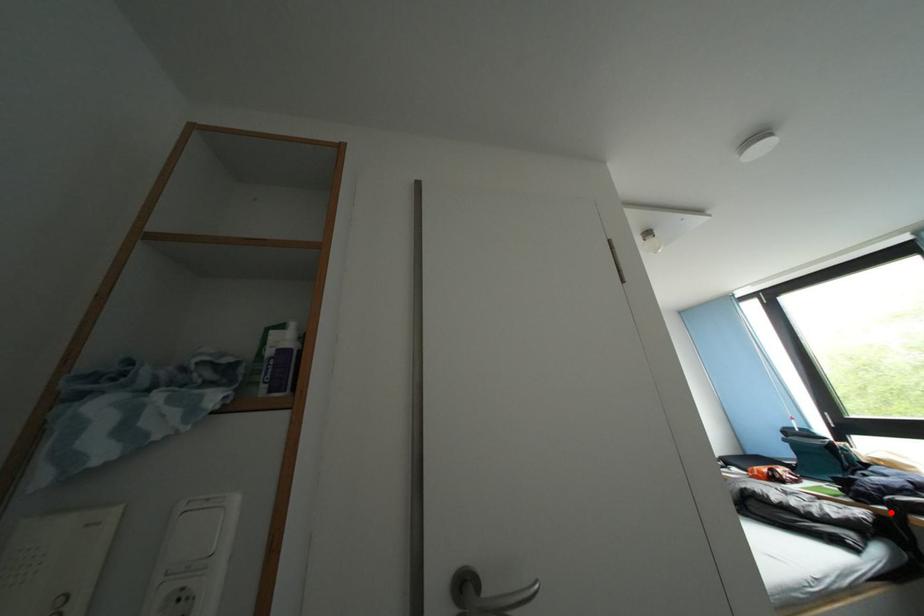
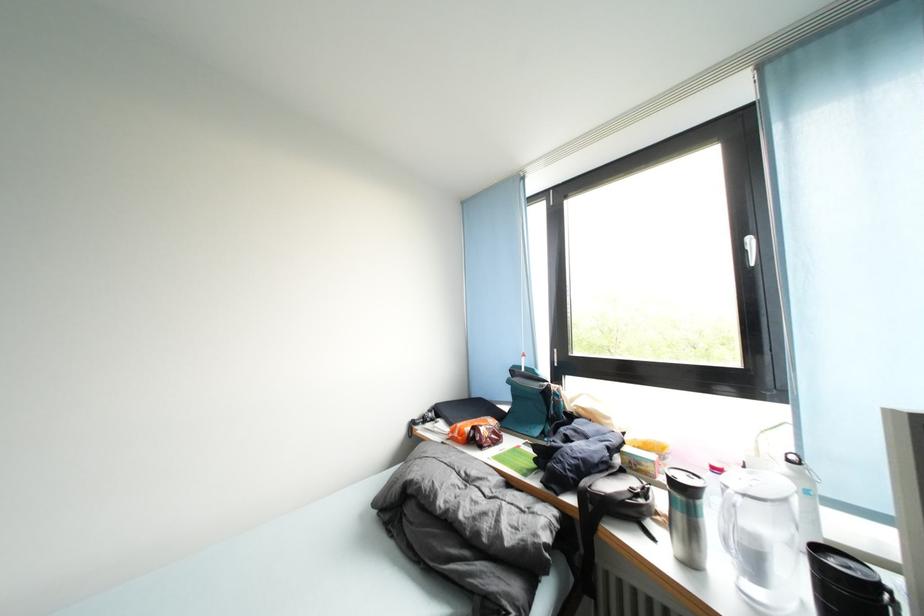
Where in the second image is the point corresponding to the highlighted location from the first image?

(579, 505)